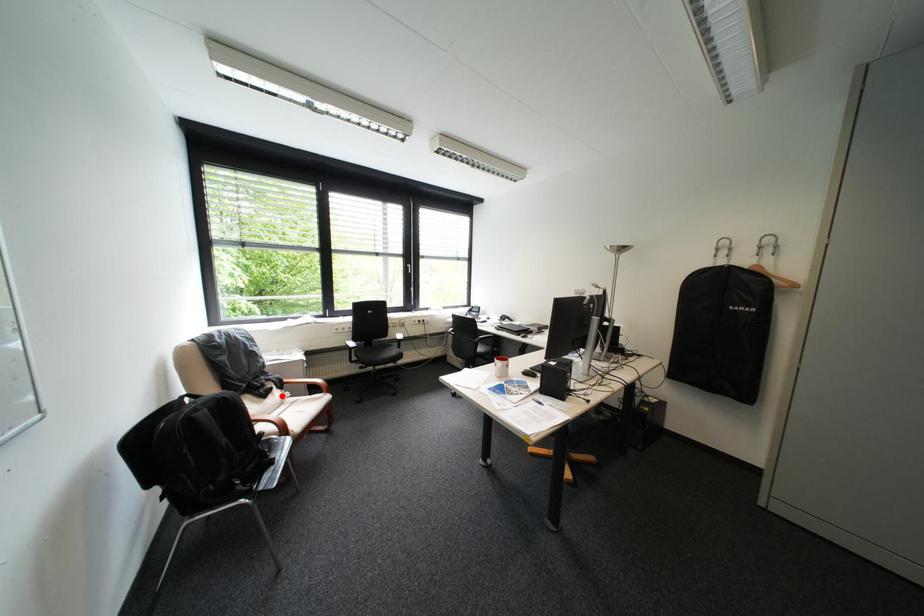
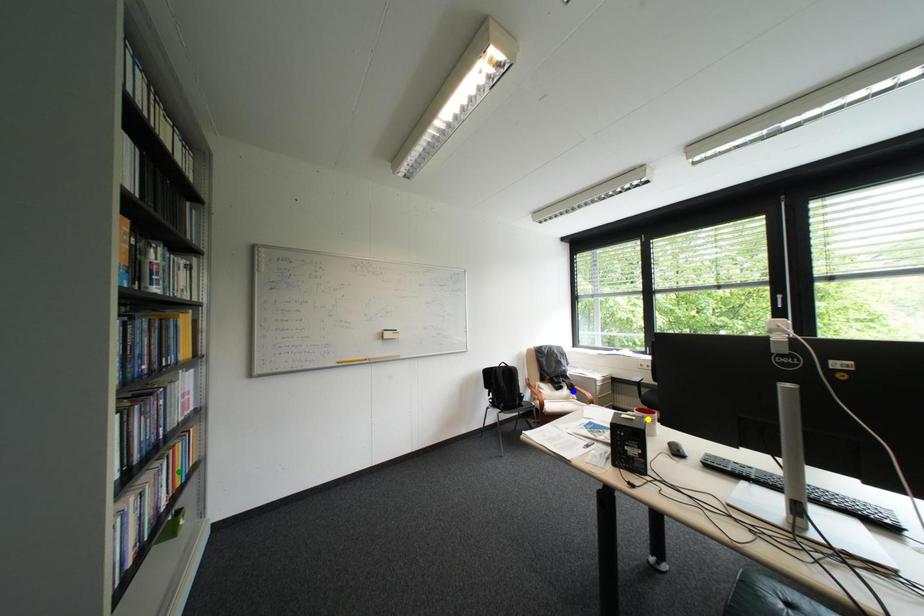
Question: I am providing you with two images of the same scene from different viewpoints. A red point is marked on the first image. You are given multiple points on the second image. In image 2, which mark is for the same physical point as the one in image 1?

Choices:
 (A) blue point
 (B) green point
 (C) yellow point

Answer: (A)